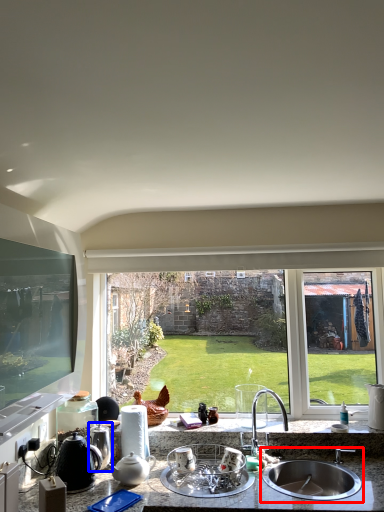
Question: Which of the following is the closest to the observer, sink (highlighted by a red box) or appliance (highlighted by a blue box)?

Choices:
 (A) sink
 (B) appliance

Answer: (A)